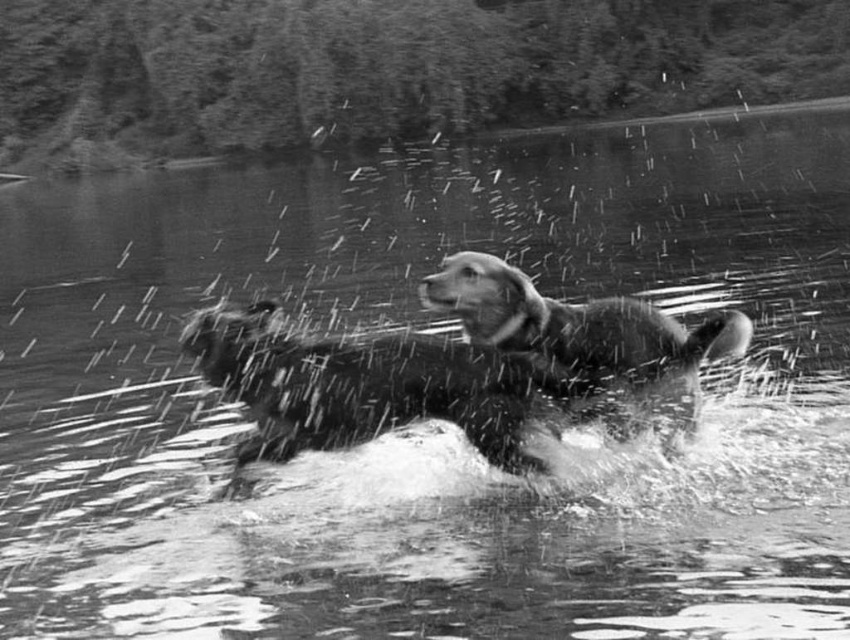
Can you confirm if fluffy wet dog at center is bigger than soft fur dog at center?

Correct, fluffy wet dog at center is larger in size than soft fur dog at center.

Consider the image. Who is more distant from viewer, [411,417] or [734,342]?

The point [411,417] is behind.

Between point (204, 378) and point (591, 364), which one is positioned in front?

Point (591, 364)

The height and width of the screenshot is (640, 850). I want to click on fluffy wet dog at center, so click(364, 387).